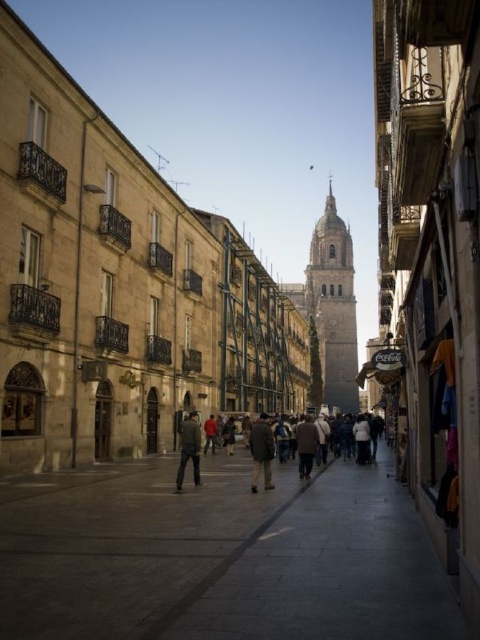
Can you confirm if stone tower at center is smaller than dark gray jacket at center?

No.

Does stone tower at center appear on the right side of dark gray jacket at center?

Correct, you'll find stone tower at center to the right of dark gray jacket at center.

This screenshot has height=640, width=480. I want to click on stone tower at center, so click(333, 307).

Where is `stone tower at center`? The image size is (480, 640). stone tower at center is located at coordinates (333, 307).

Who is taller, dark gray stone pavement at center or brown leather jacket at center?

brown leather jacket at center

Who is positioned more to the left, dark gray stone pavement at center or brown leather jacket at center?

From the viewer's perspective, dark gray stone pavement at center appears more on the left side.

Does point (371, 589) come in front of point (310, 449)?

Yes, it is in front of point (310, 449).

Find the location of `dark gray stone pavement at center`. dark gray stone pavement at center is located at coordinates (218, 557).

Who is higher up, dark gray stone pavement at center or dark brown leather jacket at center?

dark gray stone pavement at center is higher up.

From the picture: Can you confirm if dark gray stone pavement at center is positioned to the right of dark brown leather jacket at center?

In fact, dark gray stone pavement at center is to the left of dark brown leather jacket at center.

Does point (12, 627) come closer to viewer compared to point (311, 440)?

Yes, point (12, 627) is in front of point (311, 440).

Locate an element on the screen. The height and width of the screenshot is (640, 480). dark gray stone pavement at center is located at coordinates (218, 557).